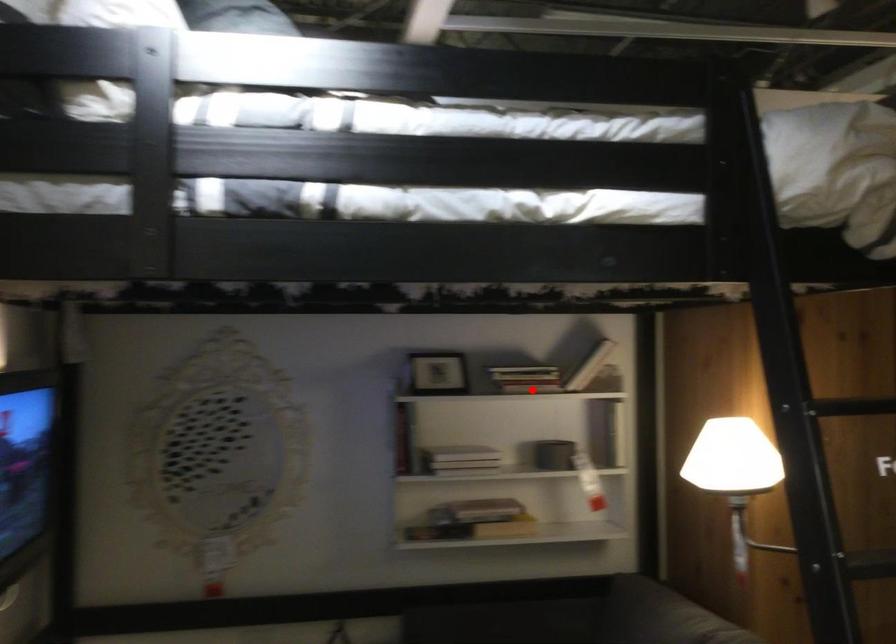
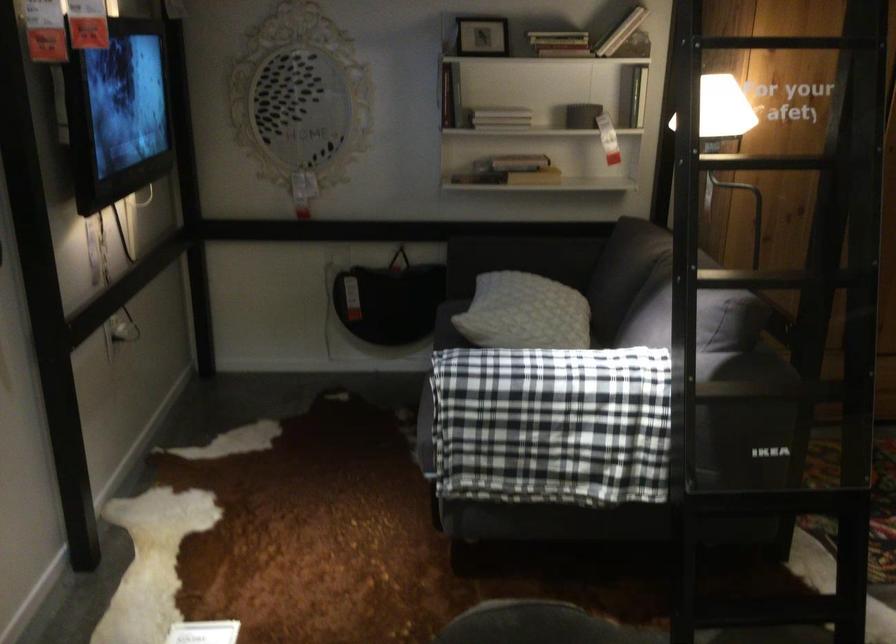
Question: I am providing you with two images of the same scene from different viewpoints. Image1 has a red point marked. In image2, the corresponding 3D location appears at what relative position? Reply with the corresponding letter.

Choices:
 (A) Closer
 (B) Farther

Answer: (B)